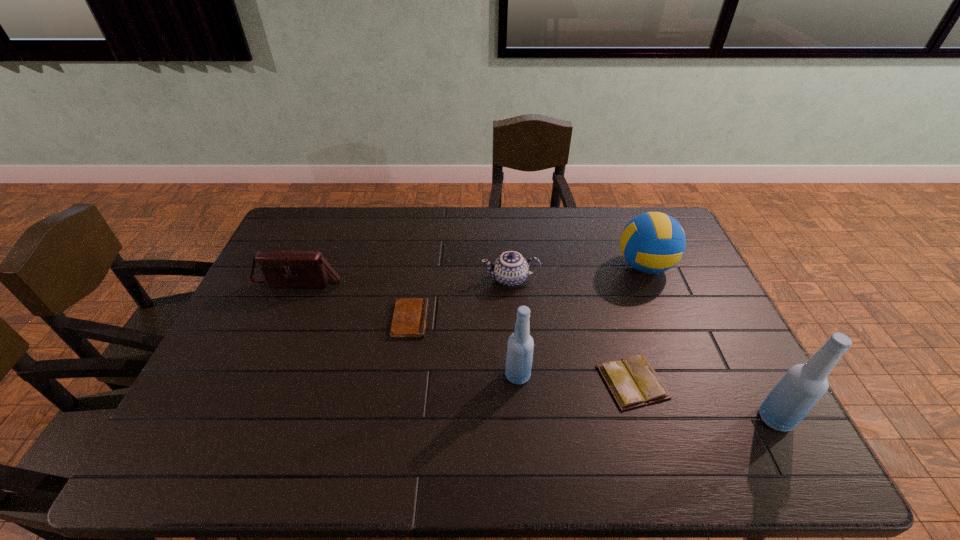
This screenshot has width=960, height=540. I want to click on the sixth shortest object, so click(x=520, y=345).

Find the location of `the farther bottle`. the farther bottle is located at coordinates (520, 345).

Locate an element on the screen. the right bottle is located at coordinates [x=803, y=385].

Find the location of a particular element. the taller bottle is located at coordinates (803, 385).

Identify the location of the third shortest object. (510, 269).

Where is `volleyball`? volleyball is located at coordinates (653, 242).

Locate an element on the screen. the farther diary is located at coordinates [x=409, y=320].

The height and width of the screenshot is (540, 960). What are the coordinates of `the fourth nearest object` in the screenshot? It's located at (409, 320).

Identify the location of the right diary. (633, 382).

You are a GUI agent. You are given a task and a screenshot of the screen. Output one action in this format:
    pyautogui.click(x=<x>, y=<y>)
    Task: Click on the leftmost object
    The height and width of the screenshot is (540, 960).
    Given the screenshot: What is the action you would take?
    pyautogui.click(x=280, y=269)